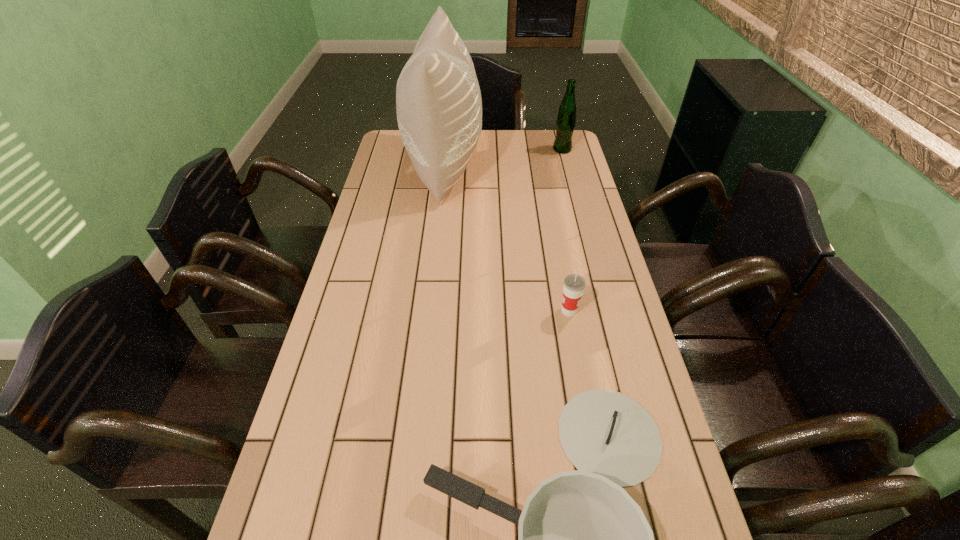
This screenshot has height=540, width=960. I want to click on cushion, so click(438, 101).

This screenshot has width=960, height=540. Identify the location of the third shortest object. (566, 119).

Where is `the third tallest object`? This screenshot has width=960, height=540. the third tallest object is located at coordinates (573, 288).

Identify the location of the third farthest object. (573, 288).

Find the location of a particular element. This screenshot has height=540, width=960. vacant space located 0.080m on the front side of the cushion is located at coordinates (504, 167).

This screenshot has height=540, width=960. Identify the location of free point located 0.400m on the left of the third shortest object. (448, 150).

Where is `vacant area located on the side of the cup with the logo`? This screenshot has width=960, height=540. vacant area located on the side of the cup with the logo is located at coordinates (460, 311).

You are a GUI agent. You are given a task and a screenshot of the screen. Output one action in this format:
    pyautogui.click(x=<x>, y=<y>)
    Task: Click on the free space located on the side of the cup with the logo
    The height and width of the screenshot is (540, 960).
    Given the screenshot: What is the action you would take?
    (x=447, y=311)

At what (x,y) coordinates should I click in order to perform the action: click on vacant area located 0.210m on the side of the cup with the logo. Please return your answer as a coordinate pair (x, y). This screenshot has width=960, height=540. Looking at the image, I should click on (475, 311).

Identify the location of cushion located in the far edge section of the desktop. (438, 101).